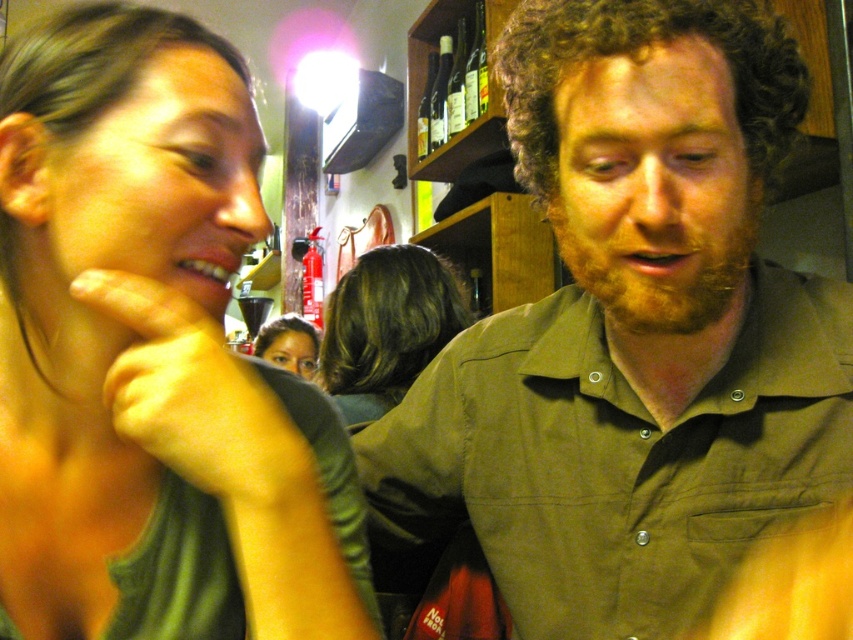
You are a bartender who needs to grab a bottle from the clear glass bottles at upper center while standing near the green cotton shirt at center. Can you reach the bottles without moving your feet? The average arm length of a person is about 2.5 feet.

The distance between the green cotton shirt at center and the clear glass bottles at upper center is 4.56 feet, which is greater than the average arm length of 2.5 feet. Therefore, you cannot reach the bottles without moving your feet.

Based on the photo, you are a bartender preparing to place a new set of clear glass bottles at upper center on the shelf. The green cotton shirt at center is currently blocking the shelf space. Can you fit the bottles there without moving the shirt?

The green cotton shirt at center is much taller than the clear glass bottles at upper center, so it is blocking the shelf space. You will need to move the green cotton shirt at center to make room for the bottles.

What are the coordinates of the green cotton shirt at center?

The green cotton shirt at center is located at point (633, 333).